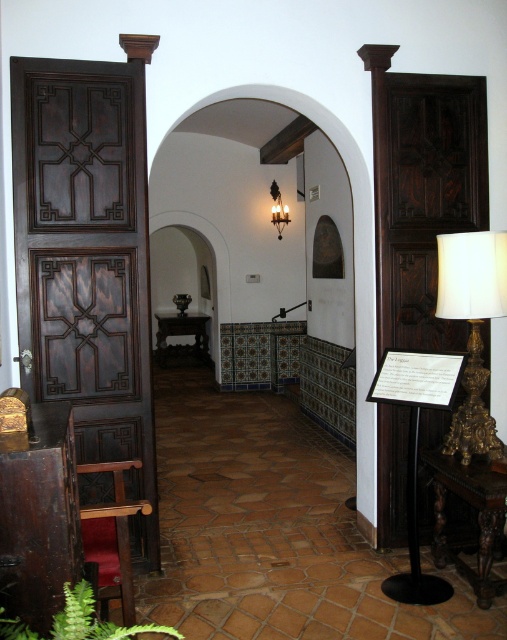
In the scene shown: You are an interior designer assessing the space between the dark wood paneling at left and the gold ornate lamp at right. Which object is wider?

The dark wood paneling at left is wider than the gold ornate lamp at right according to their widths.

You are an interior designer assessing the space. You need to place a large potted plant that requires a lot of sunlight next to the dark wood carved door at right or the green leafy fern at lower left. Based on their sizes, which object would allow more space for the plant?

The dark wood carved door at right is larger in size than the green leafy fern at lower left, so placing the large potted plant next to the dark wood carved door at right would provide more space.